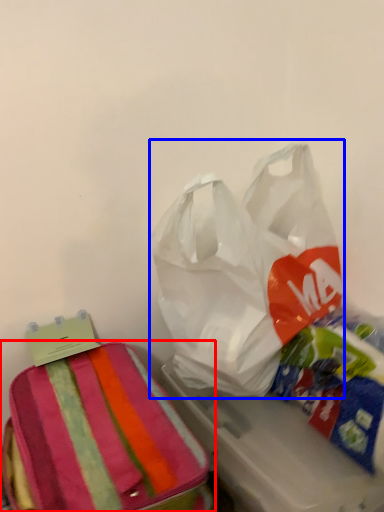
Question: Which object appears closest to the camera in this image, luggage and bags (highlighted by a red box) or plastic bag (highlighted by a blue box)?

Choices:
 (A) luggage and bags
 (B) plastic bag

Answer: (A)